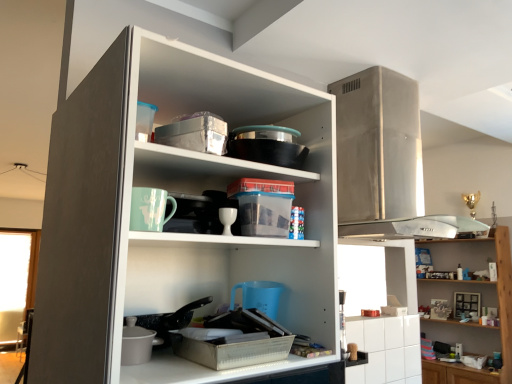
Question: In the image, is wooden shelves at upper right on the left side or the right side of white matte cupboard at center?

Choices:
 (A) right
 (B) left

Answer: (A)

Question: Is point (465, 248) closer or farther from the camera than point (83, 256)?

Choices:
 (A) closer
 (B) farther

Answer: (B)

Question: Which of these objects is positioned farthest from the white matte cupboard at center?

Choices:
 (A) white glossy cup at center
 (B) wooden shelves at upper right
 (C) white glossy cabinet at lower right

Answer: (B)

Question: Which object is the farthest from the wooden shelves at upper right?

Choices:
 (A) white matte cupboard at center
 (B) white glossy cup at center
 (C) white glossy cabinet at lower right

Answer: (B)